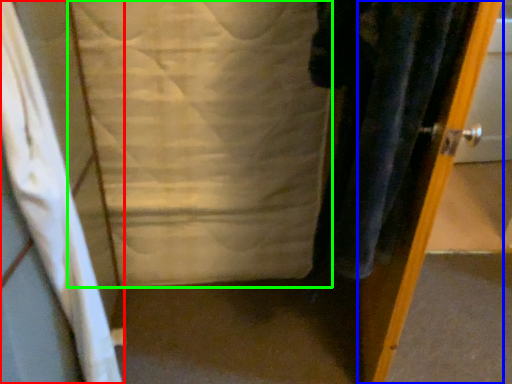
Question: Which is nearer to the curtain (highlighted by a red box)? door (highlighted by a blue box) or sheet (highlighted by a green box).

Choices:
 (A) door
 (B) sheet

Answer: (B)